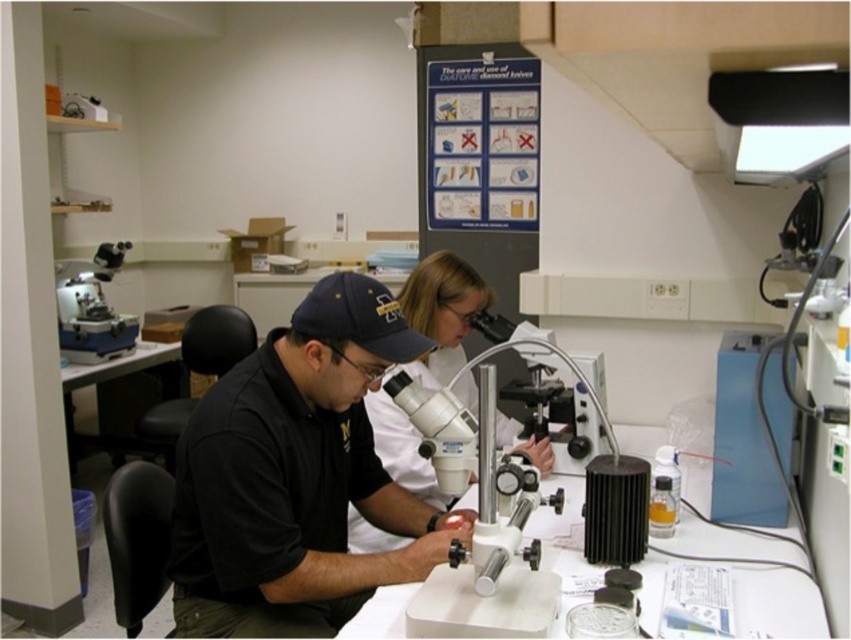
Question: Which point is farther from the camera taking this photo?

Choices:
 (A) (414, 276)
 (B) (355, 586)
 (C) (557, 492)

Answer: (A)

Question: Does black matte shirt at center appear on the left side of matte white microscope at upper left?

Choices:
 (A) no
 (B) yes

Answer: (A)

Question: Can you confirm if white plastic microscope at center is positioned below matte white microscope at upper left?

Choices:
 (A) yes
 (B) no

Answer: (A)

Question: Which point is closer to the camera?

Choices:
 (A) (300, 449)
 (B) (414, 282)
 (C) (415, 600)

Answer: (C)

Question: Does black matte shirt at center appear on the right side of matte white lab coat at center?

Choices:
 (A) yes
 (B) no

Answer: (B)

Question: Which object appears farthest from the camera in this image?

Choices:
 (A) matte white microscope at upper left
 (B) matte white lab coat at center
 (C) white plastic microscope at center
 (D) black matte shirt at center

Answer: (A)